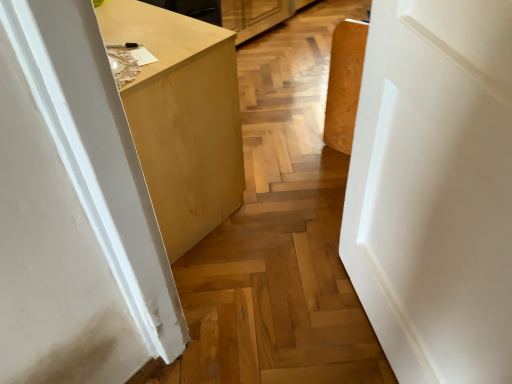
Identify the location of free point to the right of matte wood cabinet at center. The width and height of the screenshot is (512, 384). (283, 187).